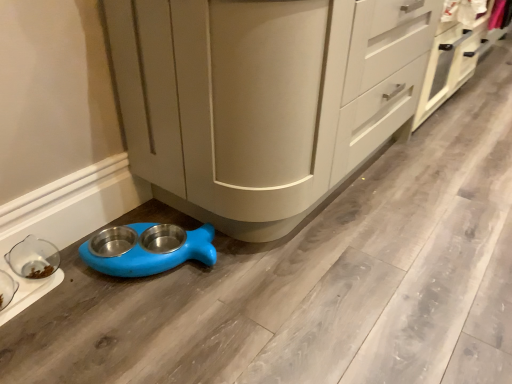
Identify the location of vacant space in front of matte beige cabinet at lower center, the first cabinetry in the left-to-right sequence. (296, 309).